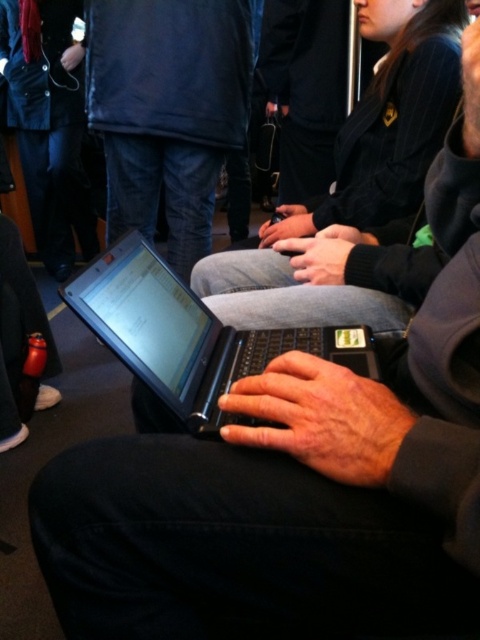
What are the exact coordinates of the matte black laptop at center in the image?

The matte black laptop at center is located at point (168,108).

You are a person sitting in a conference room and you see the point marked at coordinate (168, 108). What object is located at that point?

The point at coordinate (168, 108) marks the matte black laptop at center.